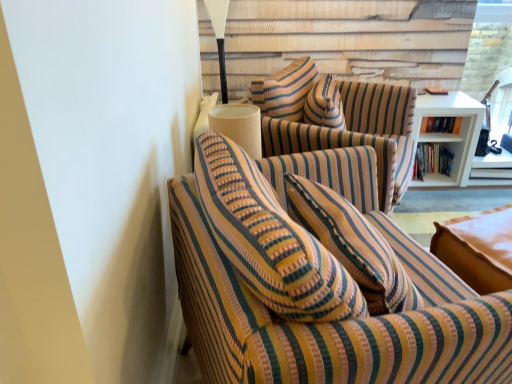
Question: From the image's perspective, would you say hardcover books at right, acting as the second book starting from the top, is positioned over striped fabric couch at left?

Choices:
 (A) yes
 (B) no

Answer: (A)

Question: From a real-world perspective, is hardcover books at right, the 1th book when ordered from bottom to top, located beneath striped fabric couch at left?

Choices:
 (A) yes
 (B) no

Answer: (A)

Question: Is there a large distance between hardcover books at right, acting as the second book starting from the top, and striped fabric couch at left?

Choices:
 (A) yes
 (B) no

Answer: (A)

Question: From the image's perspective, is hardcover books at right, the 1th book when ordered from bottom to top, located beneath striped fabric couch at left?

Choices:
 (A) no
 (B) yes

Answer: (A)

Question: Is hardcover books at right, acting as the second book starting from the top, taller than striped fabric couch at left?

Choices:
 (A) yes
 (B) no

Answer: (B)

Question: Is hardcover book at upper right, which is the 2th book from bottom to top, in front of or behind transparent glass door at upper right in the image?

Choices:
 (A) behind
 (B) front

Answer: (B)

Question: Would you say hardcover book at upper right, the 1th book positioned from the top, is to the left or to the right of transparent glass door at upper right in the picture?

Choices:
 (A) right
 (B) left

Answer: (B)

Question: Considering the positions of hardcover book at upper right, the 1th book positioned from the top, and transparent glass door at upper right in the image, is hardcover book at upper right, the 1th book positioned from the top, taller or shorter than transparent glass door at upper right?

Choices:
 (A) short
 (B) tall

Answer: (A)

Question: In terms of size, does hardcover book at upper right, which is the 2th book from bottom to top, appear bigger or smaller than transparent glass door at upper right?

Choices:
 (A) big
 (B) small

Answer: (B)

Question: Based on their positions, is hardcover books at right, the 1th book when ordered from bottom to top, located to the left or right of striped fabric couch at left?

Choices:
 (A) left
 (B) right

Answer: (B)

Question: From a real-world perspective, relative to striped fabric couch at left, is hardcover books at right, acting as the second book starting from the top, vertically above or below?

Choices:
 (A) above
 (B) below

Answer: (B)

Question: Do you think hardcover books at right, acting as the second book starting from the top, is within striped fabric couch at left, or outside of it?

Choices:
 (A) outside
 (B) inside

Answer: (A)

Question: Considering the positions of hardcover books at right, acting as the second book starting from the top, and striped fabric couch at left in the image, is hardcover books at right, acting as the second book starting from the top, bigger or smaller than striped fabric couch at left?

Choices:
 (A) small
 (B) big

Answer: (A)

Question: Based on their positions, is striped fabric swivel chair at center located to the left or right of white wood bookshelf at right?

Choices:
 (A) left
 (B) right

Answer: (A)

Question: From a real-world perspective, is striped fabric swivel chair at center physically located above or below white wood bookshelf at right?

Choices:
 (A) below
 (B) above

Answer: (B)